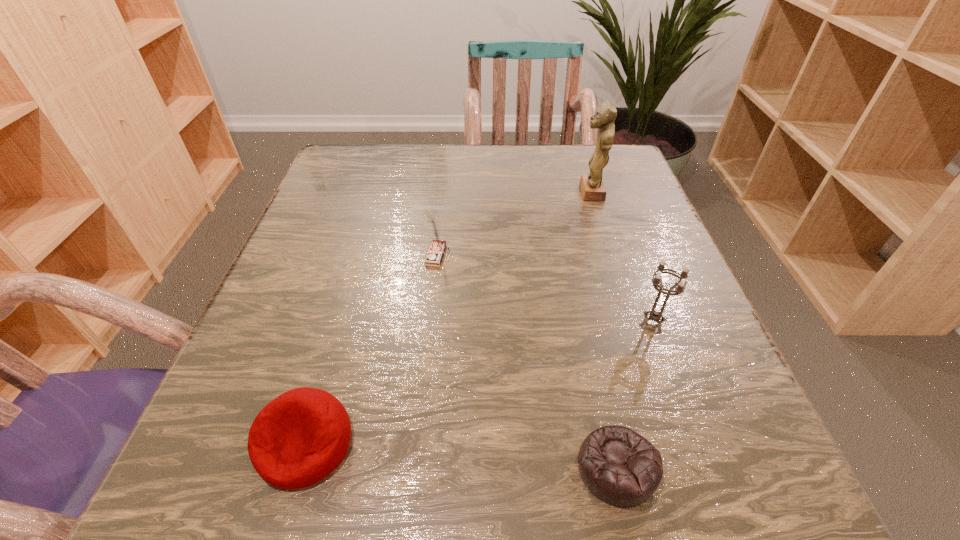
Identify the location of object at the near left corner. This screenshot has height=540, width=960. (299, 438).

I want to click on object that is positioned at the far right corner, so click(x=592, y=187).

The image size is (960, 540). Find the location of `object located at the near right corner`. object located at the near right corner is located at coordinates (619, 466).

Locate an element on the screen. Image resolution: width=960 pixels, height=540 pixels. free space at the far edge of the desktop is located at coordinates (454, 148).

Identify the location of vacant position at the near edge of the desktop. Image resolution: width=960 pixels, height=540 pixels. pyautogui.click(x=651, y=514).

I want to click on free space at the left edge of the desktop, so click(x=323, y=232).

Find the location of a particular element. This screenshot has height=540, width=960. free spot at the right edge of the desktop is located at coordinates (737, 381).

Where is `vacant space at the far left corner of the desktop`? This screenshot has width=960, height=540. vacant space at the far left corner of the desktop is located at coordinates (343, 155).

This screenshot has height=540, width=960. In the image, there is a desktop. Find the location of `blank space at the far right corner`. blank space at the far right corner is located at coordinates (583, 166).

Where is `vacant area at the near right corner`? This screenshot has width=960, height=540. vacant area at the near right corner is located at coordinates [x=765, y=471].